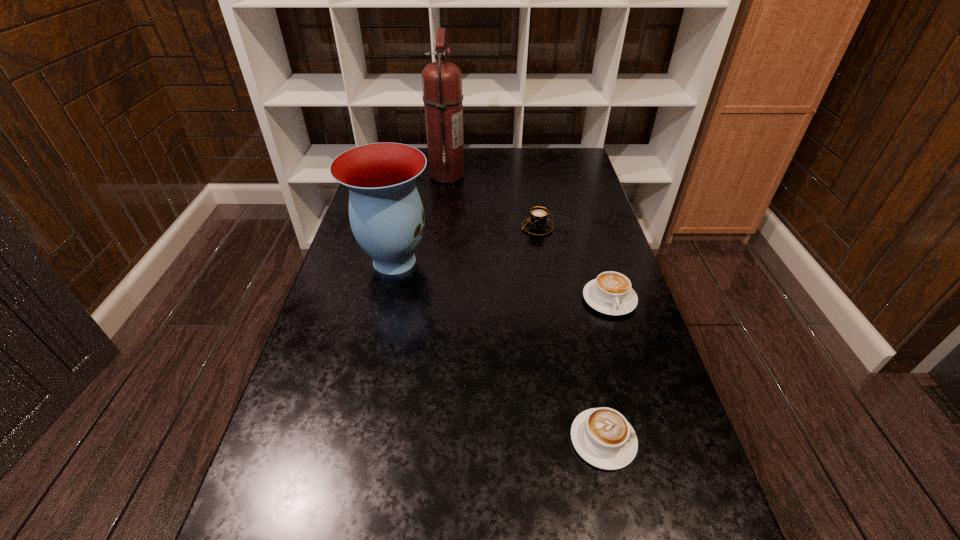
The height and width of the screenshot is (540, 960). What are the coordinates of `fire extinguisher` in the screenshot? It's located at (442, 81).

Where is `the farthest object`? The height and width of the screenshot is (540, 960). the farthest object is located at coordinates (442, 81).

Where is `the second tallest object`? The height and width of the screenshot is (540, 960). the second tallest object is located at coordinates (386, 214).

This screenshot has height=540, width=960. In order to click on the farthest cappuccino in this screenshot , I will do `click(538, 224)`.

Find the location of a particular element. The height and width of the screenshot is (540, 960). the second farthest cappuccino is located at coordinates (610, 293).

Where is `the nearest cappuccino`? The width and height of the screenshot is (960, 540). the nearest cappuccino is located at coordinates (602, 437).

Locate an element on the screen. The height and width of the screenshot is (540, 960). free space located 0.280m on the front-facing side of the tallest object is located at coordinates (541, 174).

This screenshot has height=540, width=960. In order to click on free region located on the right of the fourth shortest object in this screenshot , I will do `click(505, 261)`.

The image size is (960, 540). I want to click on vacant region located 0.140m on the back of the farthest cappuccino, so click(x=532, y=195).

You are a GUI agent. You are given a task and a screenshot of the screen. Output one action in this format:
    pyautogui.click(x=<x>, y=<y>)
    Task: Click on the free spot located on the side of the second nearest cappuccino with the handle
    
    Given the screenshot: What is the action you would take?
    pyautogui.click(x=656, y=451)